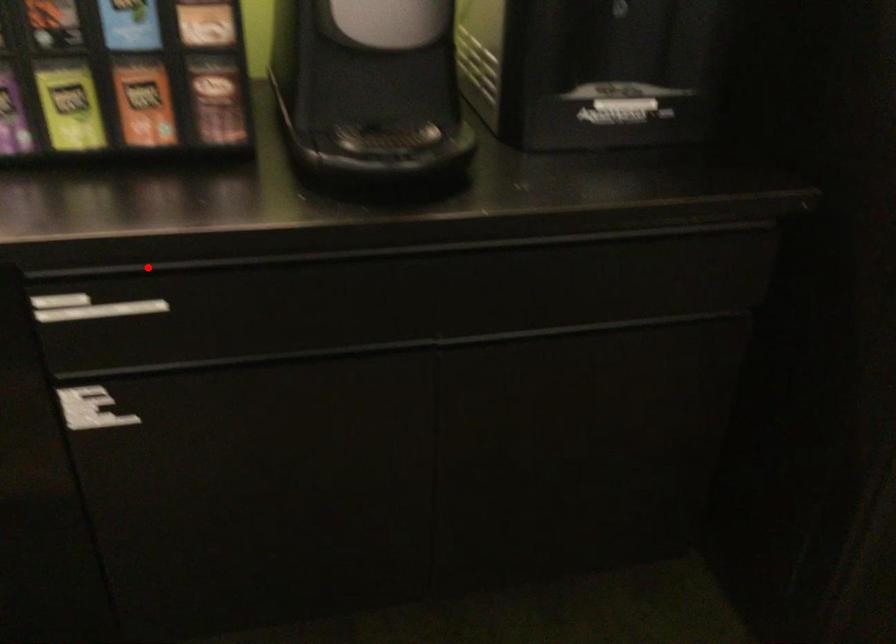
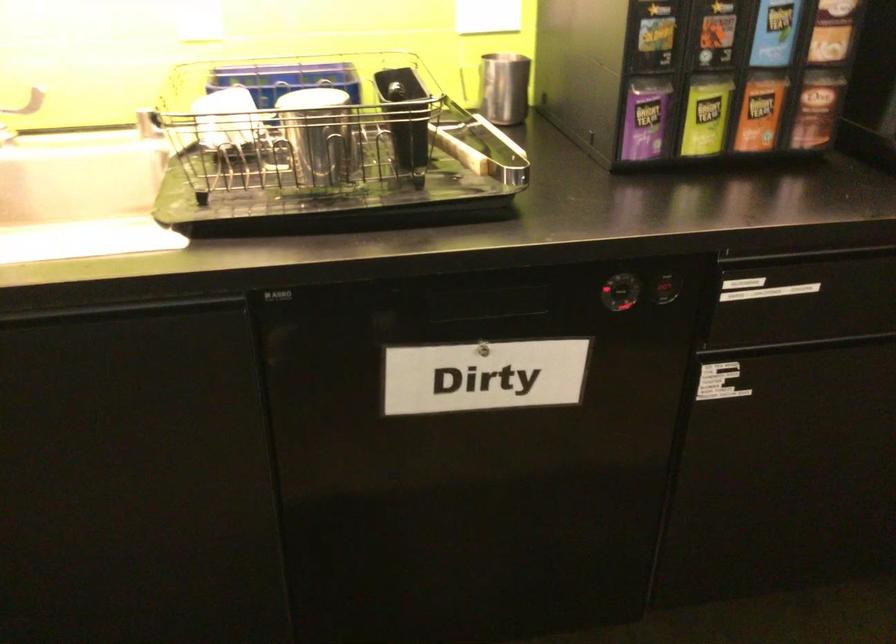
Question: I am providing you with two images of the same scene from different viewpoints. Image1 has a red point marked. In image2, the corresponding 3D location appears at what relative position? Reply with the corresponding letter.

Choices:
 (A) Closer
 (B) Farther

Answer: (B)